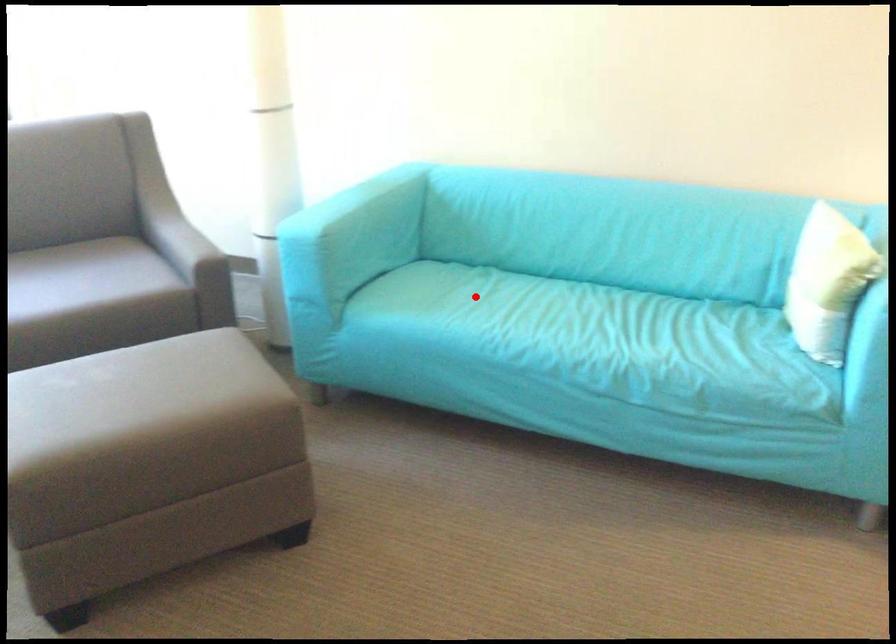
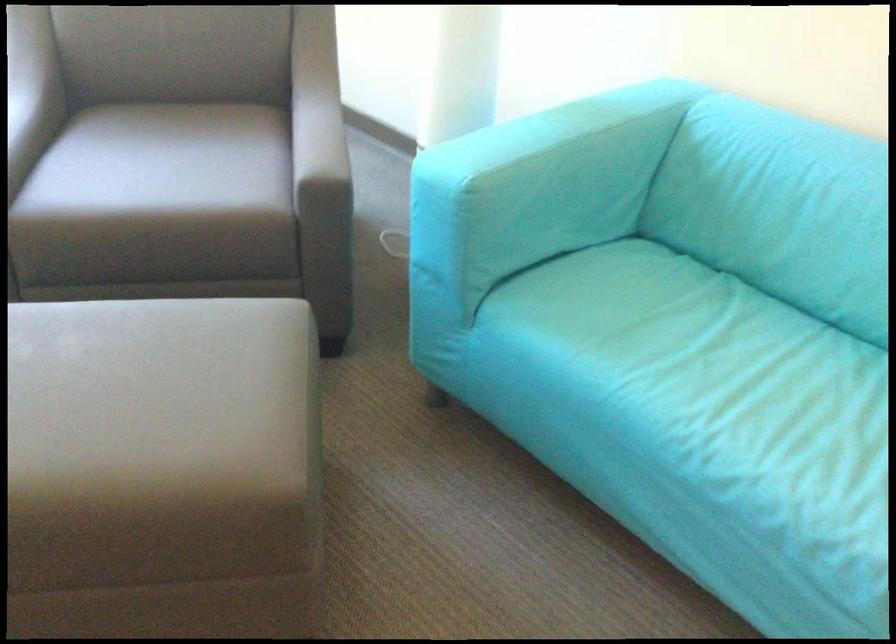
Where in the second image is the point corresponding to the highlighted location from the first image?

(699, 353)